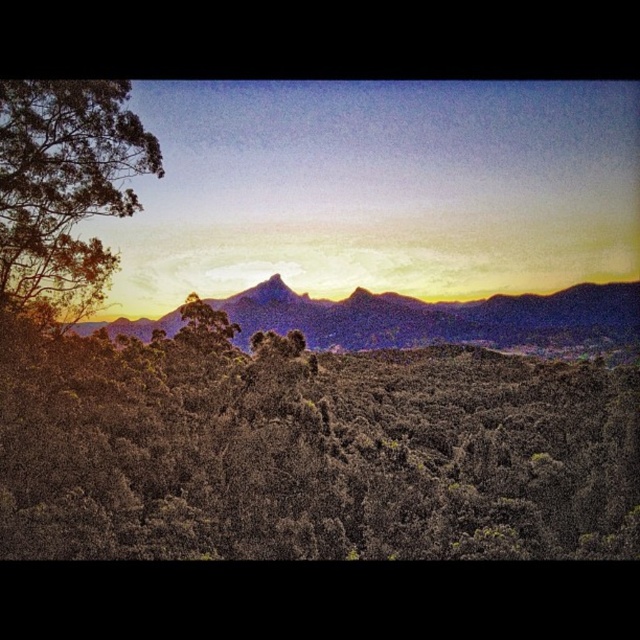
Question: Is green leafy tree at left above rugged purple mountain range at center?

Choices:
 (A) no
 (B) yes

Answer: (B)

Question: Which object appears closest to the camera in this image?

Choices:
 (A) rugged purple mountain range at center
 (B) green leafy tree at left

Answer: (B)

Question: Can you confirm if green leafy tree at left is thinner than rugged purple mountain range at center?

Choices:
 (A) no
 (B) yes

Answer: (B)

Question: Does green leafy tree at left appear on the left side of rugged purple mountain range at center?

Choices:
 (A) no
 (B) yes

Answer: (B)

Question: Among these points, which one is farthest from the camera?

Choices:
 (A) (93, 269)
 (B) (538, 308)

Answer: (B)

Question: Which point is closer to the camera?

Choices:
 (A) green leafy tree at left
 (B) rugged purple mountain range at center

Answer: (A)